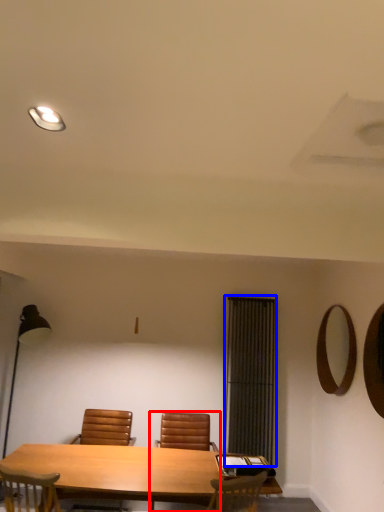
Question: Which of the following is the closest to the observer, chair (highlighted by a red box) or curtain (highlighted by a blue box)?

Choices:
 (A) chair
 (B) curtain

Answer: (A)